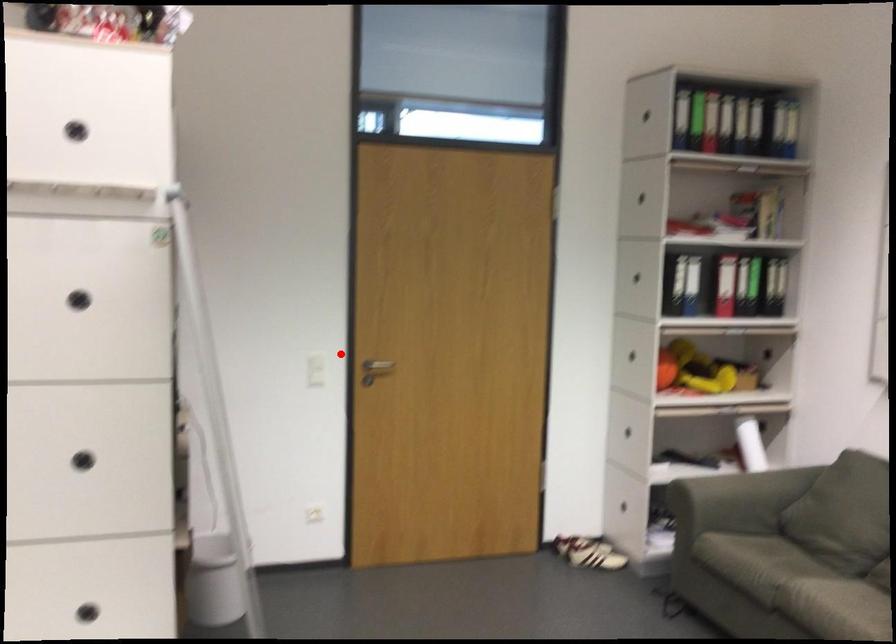
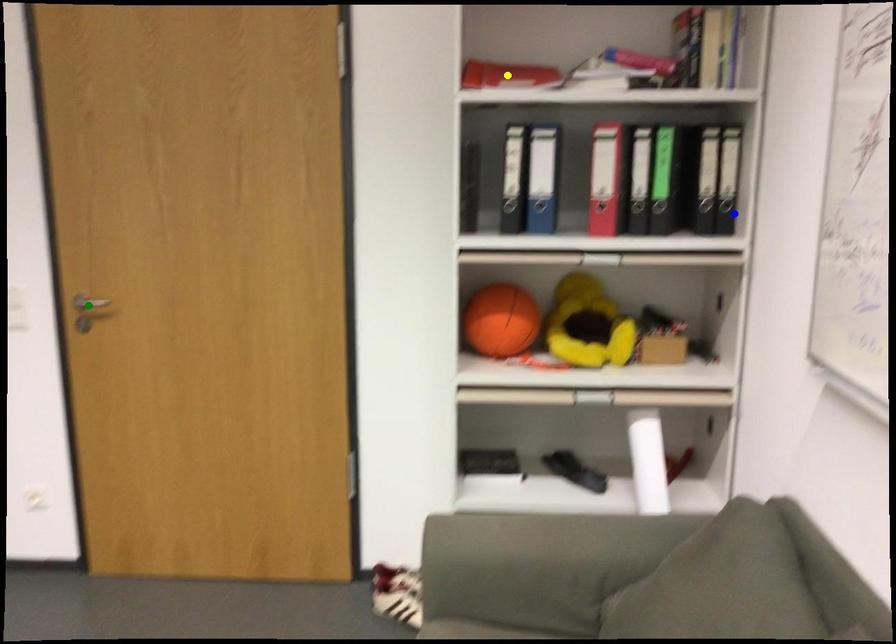
Question: I am providing you with two images of the same scene from different viewpoints. A red point is marked on the first image. You are given multiple points on the second image. Which spot in image 2 lines up with the point in image 1?

Choices:
 (A) blue point
 (B) green point
 (C) yellow point

Answer: (B)